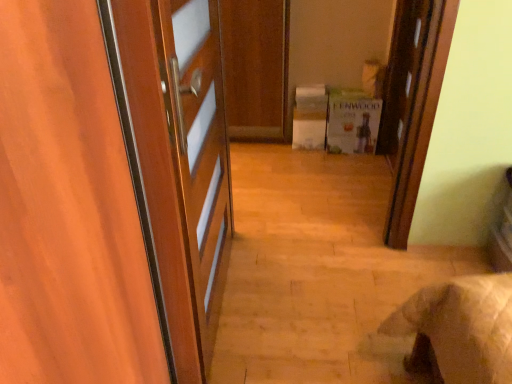
Question: Should I look upward or downward to see green cardboard box at center?

Choices:
 (A) up
 (B) down

Answer: (A)

Question: Is wooden door at left, which is counted as the first door, starting from the bottom, smaller than wooden door at upper right, which appears as the second door when ordered from the bottom?

Choices:
 (A) yes
 (B) no

Answer: (A)

Question: From the image's perspective, is wooden door at left, which is the first door from left to right, above wooden door at upper right, which ranks as the 2th door in left-to-right order?

Choices:
 (A) no
 (B) yes

Answer: (A)

Question: From the image's perspective, is wooden door at left, placed as the second door when sorted from top to bottom, located beneath wooden door at upper right, marked as the 2th door in a front-to-back arrangement?

Choices:
 (A) no
 (B) yes

Answer: (B)

Question: Is the surface of wooden door at left, which is the first door from left to right, in direct contact with wooden door at upper right, marked as the 2th door in a front-to-back arrangement?

Choices:
 (A) yes
 (B) no

Answer: (B)

Question: Does wooden door at left, the second door viewed from the back, come in front of wooden door at upper right, acting as the first door starting from the top?

Choices:
 (A) yes
 (B) no

Answer: (A)

Question: Considering the relative positions of wooden door at left, placed as the second door when sorted from top to bottom, and wooden door at upper right, acting as the first door starting from the top, in the image provided, is wooden door at left, placed as the second door when sorted from top to bottom, to the left of wooden door at upper right, acting as the first door starting from the top, from the viewer's perspective?

Choices:
 (A) no
 (B) yes

Answer: (B)

Question: Is wooden door at upper right, acting as the first door starting from the top, touching wooden door at left, the second door viewed from the back?

Choices:
 (A) no
 (B) yes

Answer: (A)

Question: Could you tell me if wooden door at upper right, which appears as the second door when ordered from the bottom, is facing wooden door at left, placed as the second door when sorted from top to bottom?

Choices:
 (A) no
 (B) yes

Answer: (A)

Question: Considering the relative positions of wooden door at upper right, which is the first door from right to left, and wooden door at left, placed as the second door when sorted from top to bottom, in the image provided, is wooden door at upper right, which is the first door from right to left, to the left of wooden door at left, placed as the second door when sorted from top to bottom, from the viewer's perspective?

Choices:
 (A) yes
 (B) no

Answer: (B)

Question: From a real-world perspective, is wooden door at upper right, which ranks as the 2th door in left-to-right order, on top of wooden door at left, which is the first door from left to right?

Choices:
 (A) no
 (B) yes

Answer: (A)

Question: Is the position of wooden door at upper right, marked as the 2th door in a front-to-back arrangement, more distant than that of wooden door at left, which is counted as the first door, starting from the bottom?

Choices:
 (A) yes
 (B) no

Answer: (A)

Question: Are wooden door at upper right, acting as the first door starting from the top, and wooden door at left, positioned as the 1th door in front-to-back order, located far from each other?

Choices:
 (A) no
 (B) yes

Answer: (B)

Question: Is green cardboard box at center at the left side of wooden door at upper right, marked as the first door in a back-to-front arrangement?

Choices:
 (A) yes
 (B) no

Answer: (A)